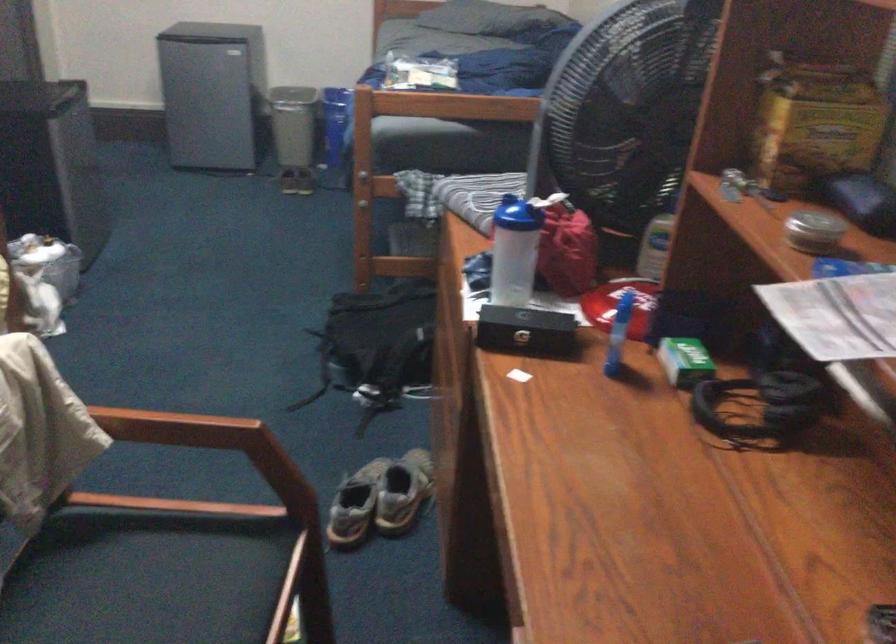
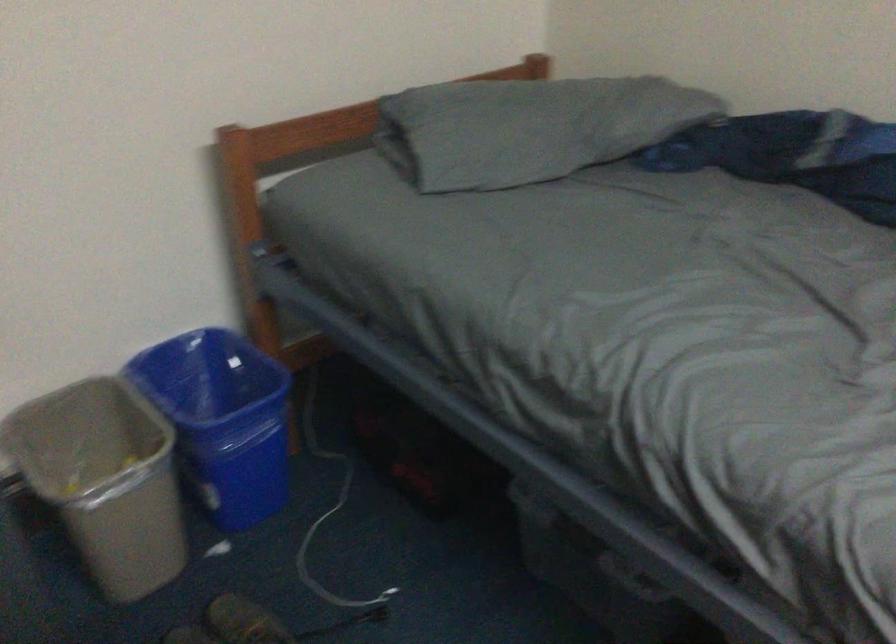
Locate, in the second image, the point that corresponds to point (263, 69) in the first image.

(104, 480)